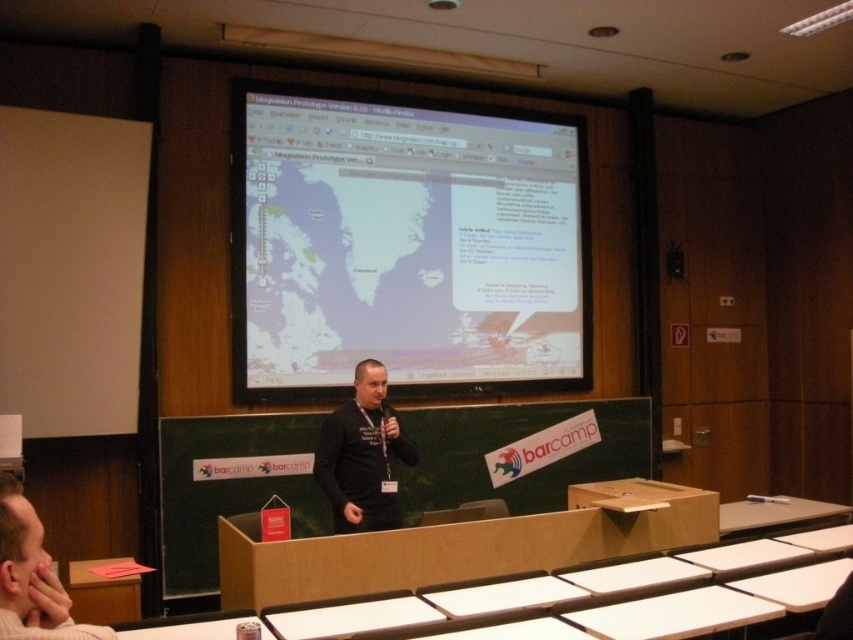
Question: Which point is farther to the camera?

Choices:
 (A) black matte shirt at center
 (B) dark gray shirt at center
 (C) matte black projector screen at upper center

Answer: (C)

Question: Observing the image, what is the correct spatial positioning of matte black projector screen at upper center in reference to black matte shirt at center?

Choices:
 (A) right
 (B) left

Answer: (A)

Question: Which point is farther to the camera?

Choices:
 (A) (357, 426)
 (B) (0, 566)

Answer: (A)

Question: Does black matte shirt at center appear on the left side of dark gray shirt at center?

Choices:
 (A) no
 (B) yes

Answer: (A)

Question: Does black matte shirt at center lie in front of dark gray shirt at center?

Choices:
 (A) yes
 (B) no

Answer: (B)

Question: Which of the following is the farthest from the observer?

Choices:
 (A) (366, 509)
 (B) (316, 195)
 (C) (4, 499)

Answer: (B)